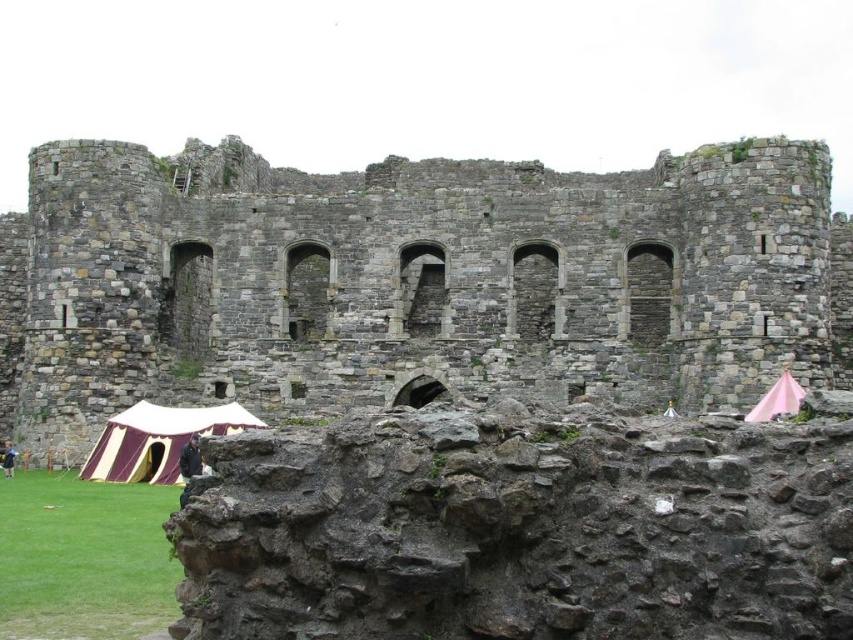
Question: Does rusty stone castle at center lie behind maroon canvas tent at lower left?

Choices:
 (A) no
 (B) yes

Answer: (A)

Question: Which of the following is the closest to the observer?

Choices:
 (A) (167, 408)
 (B) (778, 401)
 (C) (767, 204)

Answer: (B)

Question: Does rusty stone castle at center appear on the left side of pink fabric tent at lower right?

Choices:
 (A) yes
 (B) no

Answer: (A)

Question: Does maroon canvas tent at lower left have a greater width compared to pink fabric tent at lower right?

Choices:
 (A) yes
 (B) no

Answer: (A)

Question: Based on their relative distances, which object is nearer to the rusty stone castle at center?

Choices:
 (A) pink fabric tent at lower right
 (B) maroon canvas tent at lower left

Answer: (B)

Question: Which point appears closest to the camera in this image?

Choices:
 (A) (770, 413)
 (B) (653, 388)

Answer: (A)